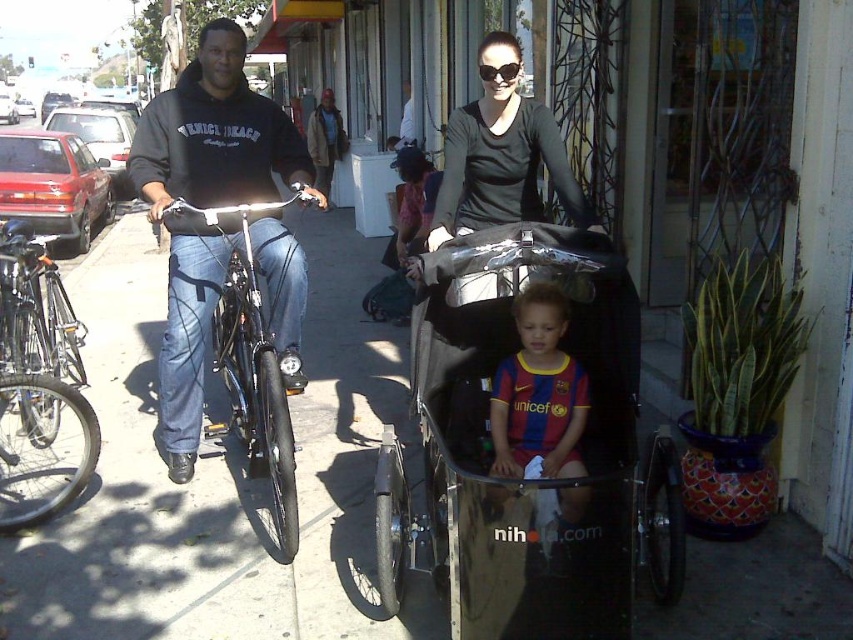
You are a delivery person trying to navigate through the sidewalk in the image. There is a point marked at coordinates (222, 477) on the sidewalk. Can you safely walk through that point without stepping on any obstacles?

The point at (222, 477) marks the smooth concrete sidewalk at center, so yes, you can safely walk through that point as it is a clear area on the sidewalk.

You are a delivery person trying to navigate through the sidewalk. The smooth concrete sidewalk at center is narrow. Considering the metallic silver baby carriage at center, will you be able to pass through the sidewalk without moving the carriage?

The smooth concrete sidewalk at center has a lesser width compared to metallic silver baby carriage at center, so it is unlikely you can pass through without moving the carriage.